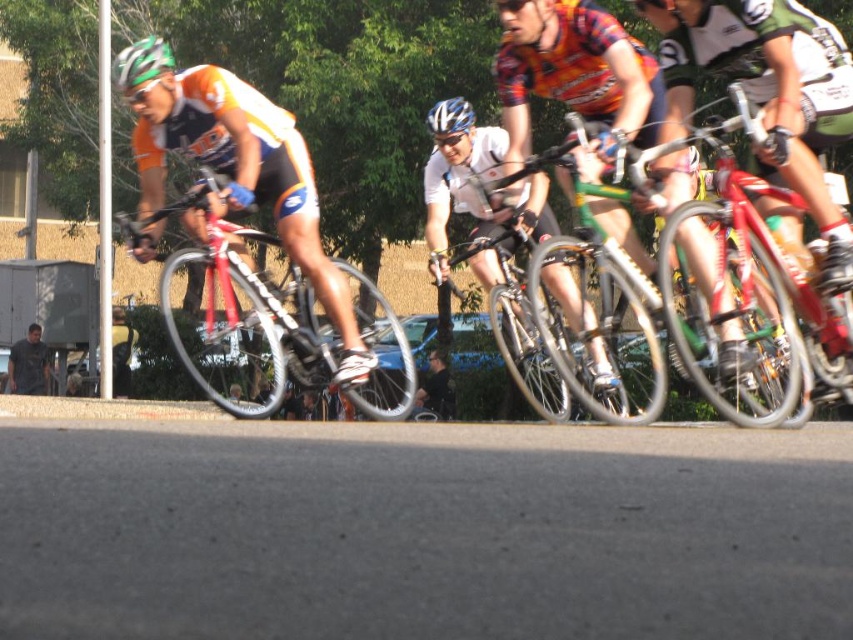
Question: Is green matte bicycle at center to the left of dark gray shirt at lower left from the viewer's perspective?

Choices:
 (A) yes
 (B) no

Answer: (B)

Question: Which object is positioned closest to the green matte helmet at upper left?

Choices:
 (A) shiny red bicycle at center
 (B) dark gray shirt at lower left

Answer: (A)

Question: Which object is farther from the camera taking this photo?

Choices:
 (A) green matte bicycle at center
 (B) dark gray shirt at lower left
 (C) shiny red bicycle at left
 (D) white matte jersey at center

Answer: (B)

Question: Is shiny red bicycle at left thinner than blue glossy helmet at center?

Choices:
 (A) no
 (B) yes

Answer: (A)

Question: Can you confirm if green matte bicycle at center is positioned above white matte jersey at center?

Choices:
 (A) yes
 (B) no

Answer: (B)

Question: Which of these objects is positioned farthest from the dark gray shirt at lower left?

Choices:
 (A) green matte helmet at upper left
 (B) blue glossy helmet at center
 (C) shiny red bicycle at center

Answer: (C)